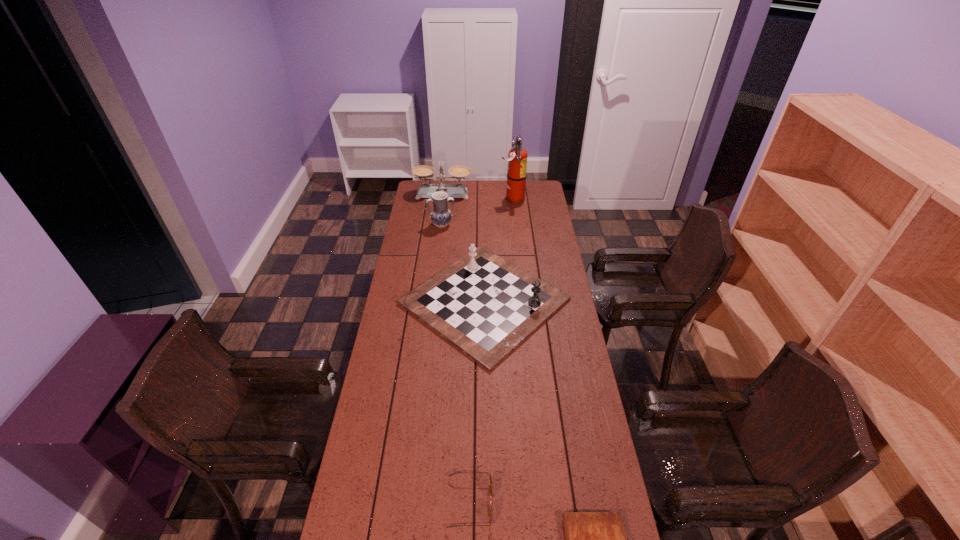
Find the location of a particular element. This screenshot has height=540, width=960. the tallest object is located at coordinates (517, 157).

Image resolution: width=960 pixels, height=540 pixels. In order to click on scale in this screenshot , I will do `click(424, 172)`.

Where is `pottery`? This screenshot has height=540, width=960. pottery is located at coordinates (441, 216).

Locate an element on the screen. The height and width of the screenshot is (540, 960). the third nearest object is located at coordinates (485, 306).

Locate an element on the screen. the fourth tallest object is located at coordinates (485, 306).

This screenshot has width=960, height=540. Find the location of `sunglasses`. sunglasses is located at coordinates (450, 475).

Image resolution: width=960 pixels, height=540 pixels. In order to click on free space located from the nozzle of the tallest object in this screenshot , I will do `click(485, 199)`.

Image resolution: width=960 pixels, height=540 pixels. What are the coordinates of `free space located from the nozzle of the tallest object` in the screenshot? It's located at (433, 199).

Find the location of a particular element. This screenshot has height=540, width=960. blank space located 0.300m from the nozzle of the tallest object is located at coordinates (448, 199).

The height and width of the screenshot is (540, 960). Find the location of `free region located 0.050m on the front-facing side of the scale`. free region located 0.050m on the front-facing side of the scale is located at coordinates (442, 205).